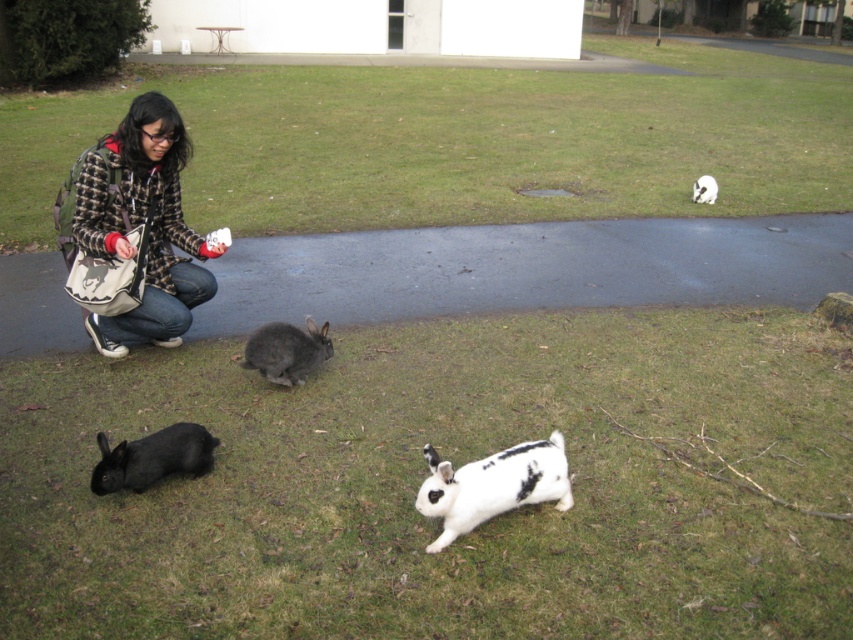
You are standing in the scene and want to walk towards the plaid wool jacket at left. Which direction should you move relative to the green grass at upper center?

You should move towards the plaid wool jacket at left, which is closer to you than the green grass at upper center, so you need to move away from the green grass at upper center.

You are a wildlife photographer aiming to capture both the black fur rabbit at lower left and the white soft fur rabbit at center in a single frame. Given their sizes, which rabbit would require you to adjust your camera to a wider angle to ensure it fits entirely in the photo?

The black fur rabbit at lower left has a larger width than the white soft fur rabbit at center, so you would need to adjust your camera to a wider angle to capture the black fur rabbit at lower left entirely in the photo.